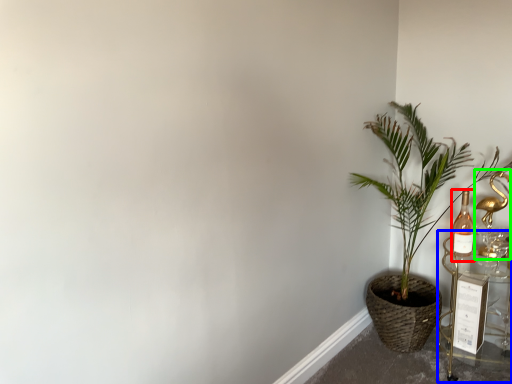
Question: Estimate the real-world distances between objects in this image. Which object is farther from bottle (highlighted by a red box), table (highlighted by a blue box) or candle holder (highlighted by a green box)?

Choices:
 (A) table
 (B) candle holder

Answer: (A)